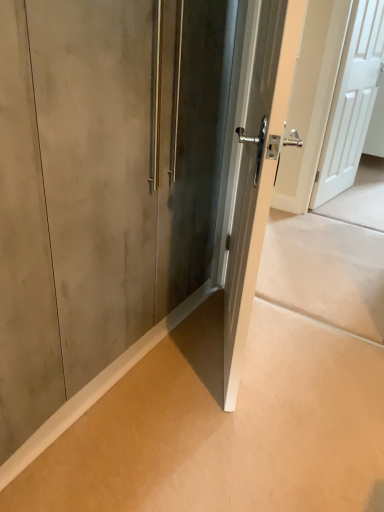
Question: Should I look upward or downward to see satin silver door at center, the 2th door positioned from the back?

Choices:
 (A) up
 (B) down

Answer: (A)

Question: From a real-world perspective, is white matte door at upper right, the 1th door from the back, located higher than matte concrete wall at lower left?

Choices:
 (A) yes
 (B) no

Answer: (A)

Question: From a real-world perspective, is white matte door at upper right, the 1th door viewed from the right, located beneath matte concrete wall at lower left?

Choices:
 (A) no
 (B) yes

Answer: (A)

Question: Is white matte door at upper right, the 1th door viewed from the right, closer to the viewer compared to matte concrete wall at lower left?

Choices:
 (A) yes
 (B) no

Answer: (B)

Question: Considering the relative sizes of white matte door at upper right, the 1th door from the back, and matte concrete wall at lower left in the image provided, is white matte door at upper right, the 1th door from the back, smaller than matte concrete wall at lower left?

Choices:
 (A) yes
 (B) no

Answer: (B)

Question: Considering the relative sizes of white matte door at upper right, which ranks as the 2th door in front-to-back order, and matte concrete wall at lower left in the image provided, is white matte door at upper right, which ranks as the 2th door in front-to-back order, bigger than matte concrete wall at lower left?

Choices:
 (A) yes
 (B) no

Answer: (A)

Question: Is white matte door at upper right, the 1th door viewed from the right, further to camera compared to matte concrete wall at lower left?

Choices:
 (A) no
 (B) yes

Answer: (B)

Question: Considering the relative sizes of satin silver door at center, placed as the 1th door when sorted from left to right, and white matte door at upper right, the 1th door from the back, in the image provided, is satin silver door at center, placed as the 1th door when sorted from left to right, wider than white matte door at upper right, the 1th door from the back,?

Choices:
 (A) no
 (B) yes

Answer: (B)

Question: From a real-world perspective, is satin silver door at center, the 2th door positioned from the back, located beneath white matte door at upper right, the 1th door viewed from the right?

Choices:
 (A) yes
 (B) no

Answer: (A)

Question: From the image's perspective, is satin silver door at center, acting as the first door starting from the front, located above white matte door at upper right, which ranks as the second door in left-to-right order?

Choices:
 (A) no
 (B) yes

Answer: (A)

Question: Is the position of satin silver door at center, placed as the 1th door when sorted from left to right, more distant than that of white matte door at upper right, which ranks as the 2th door in front-to-back order?

Choices:
 (A) no
 (B) yes

Answer: (A)

Question: Can we say satin silver door at center, placed as the 1th door when sorted from left to right, lies outside white matte door at upper right, which ranks as the second door in left-to-right order?

Choices:
 (A) no
 (B) yes

Answer: (B)

Question: Can you confirm if satin silver door at center, the 2th door positioned from the back, is shorter than white matte door at upper right, the 1th door viewed from the right?

Choices:
 (A) yes
 (B) no

Answer: (A)

Question: From a real-world perspective, is matte concrete wall at lower left positioned under white matte door at upper right, the 1th door from the back, based on gravity?

Choices:
 (A) no
 (B) yes

Answer: (B)